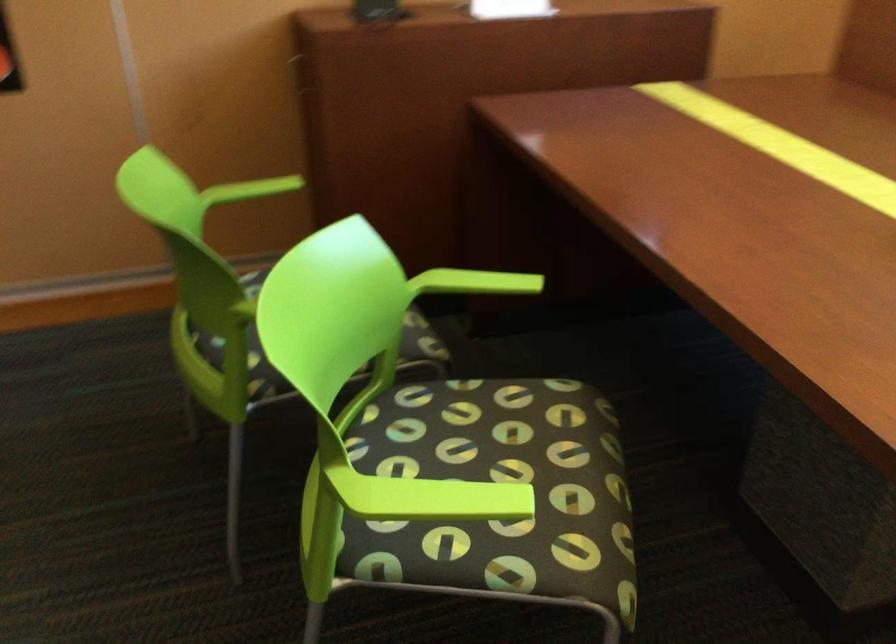
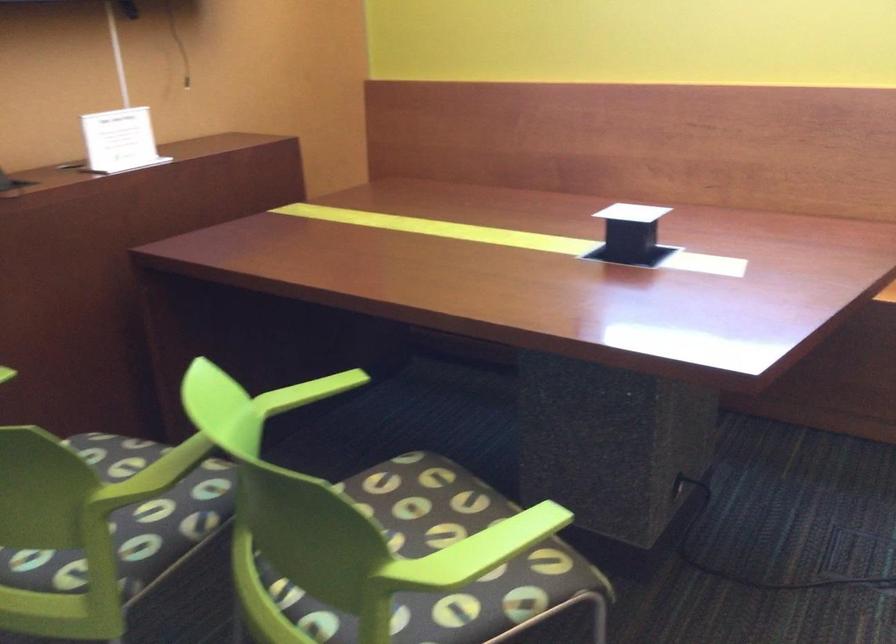
Locate, in the second image, the point that corresponds to point (478, 281) in the first image.

(307, 392)